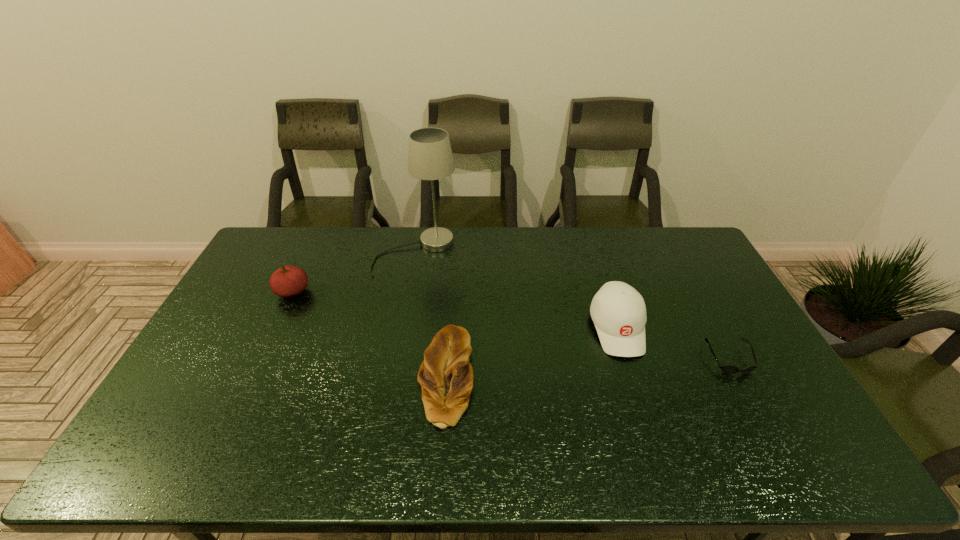
You are a GUI agent. You are given a task and a screenshot of the screen. Output one action in this format:
    pyautogui.click(x=<x>, y=<y>)
    Task: Click on the object that is the third closest to the bread
    The height and width of the screenshot is (540, 960).
    Given the screenshot: What is the action you would take?
    pyautogui.click(x=287, y=281)

This screenshot has height=540, width=960. I want to click on object that stands as the second closest to the baseball cap, so click(x=446, y=377).

Find the location of a particular element. free space that satisfies the following two spatial constraints: 1. on the front side of the tallest object; 2. on the right side of the bread is located at coordinates (395, 377).